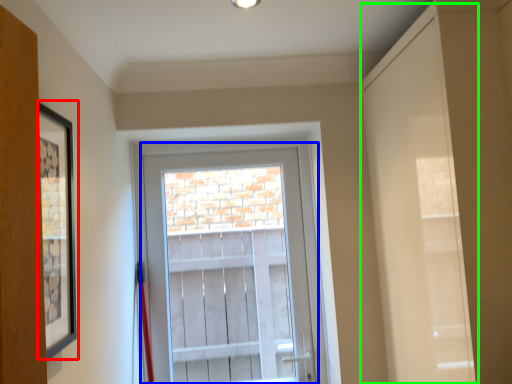
Question: Based on their relative distances, which object is nearer to picture frame (highlighted by a red box)? Choose from glass door (highlighted by a blue box) and door (highlighted by a green box).

Choices:
 (A) glass door
 (B) door

Answer: (B)